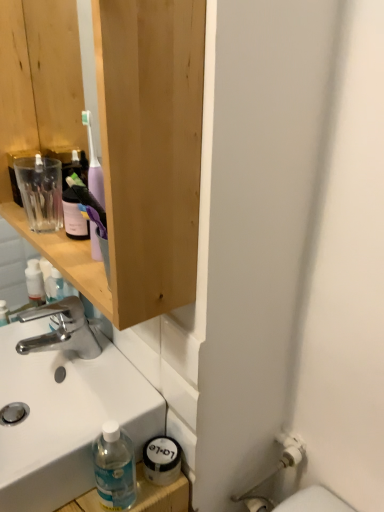
This screenshot has width=384, height=512. I want to click on vacant area that is situated to the right of polished chrome faucet at center, so click(120, 370).